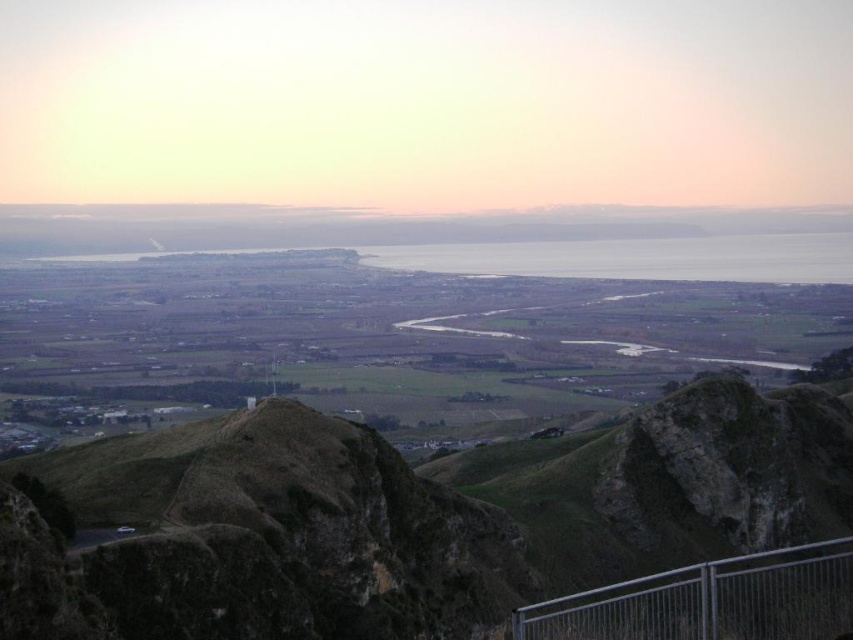
Question: Observing the image, what is the correct spatial positioning of brown rocky mountain at center in reference to metallic silver rail at lower right?

Choices:
 (A) right
 (B) left

Answer: (B)

Question: Which point is farther to the camera?

Choices:
 (A) metallic silver rail at lower right
 (B) brown rocky mountain at center

Answer: (B)

Question: Which point is closer to the camera?

Choices:
 (A) brown rocky mountain at center
 (B) metallic silver rail at lower right

Answer: (B)

Question: Which of the following is the farthest from the observer?

Choices:
 (A) brown rocky mountain at center
 (B) metallic silver rail at lower right

Answer: (A)

Question: Can you confirm if brown rocky mountain at center is wider than metallic silver rail at lower right?

Choices:
 (A) no
 (B) yes

Answer: (B)

Question: Observing the image, what is the correct spatial positioning of brown rocky mountain at center in reference to metallic silver rail at lower right?

Choices:
 (A) left
 (B) right

Answer: (A)